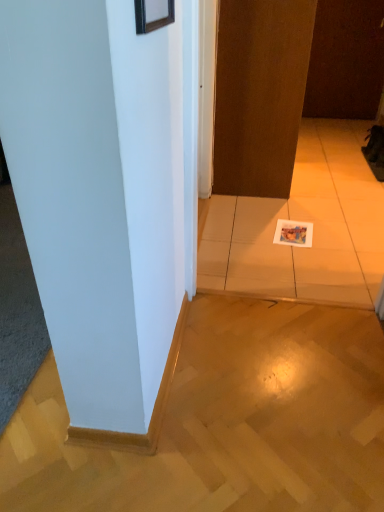
Question: Is point (256, 65) closer or farther from the camera than point (360, 53)?

Choices:
 (A) closer
 (B) farther

Answer: (A)

Question: From the image's perspective, is brown matte door at center, which is the first door from left to right, located above or below brown matte door at upper right, which is counted as the second door, starting from the left?

Choices:
 (A) above
 (B) below

Answer: (B)

Question: Which of these objects is positioned farthest from the brown matte door at center, placed as the 1th door when sorted from bottom to top?

Choices:
 (A) wooden picture frame at upper center
 (B) white smooth pillar at center
 (C) brown matte door at upper right, the 1th door viewed from the back

Answer: (C)

Question: Estimate the real-world distances between objects in this image. Which object is farther from the brown matte door at center, placed as the first door when sorted from front to back?

Choices:
 (A) white smooth pillar at center
 (B) brown matte door at upper right, which is the 1th door from right to left
 (C) wooden picture frame at upper center

Answer: (B)